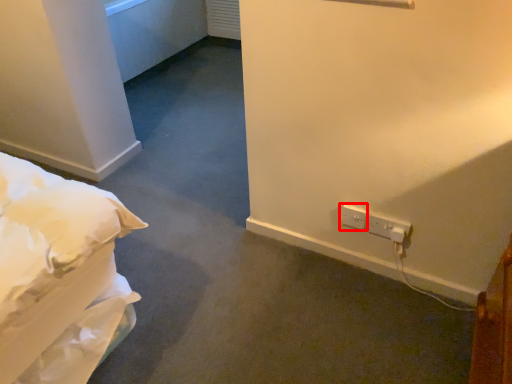
Question: From the image's perspective, where is electric outlet (annotated by the red box) located relative to electric outlet?

Choices:
 (A) below
 (B) above

Answer: (B)